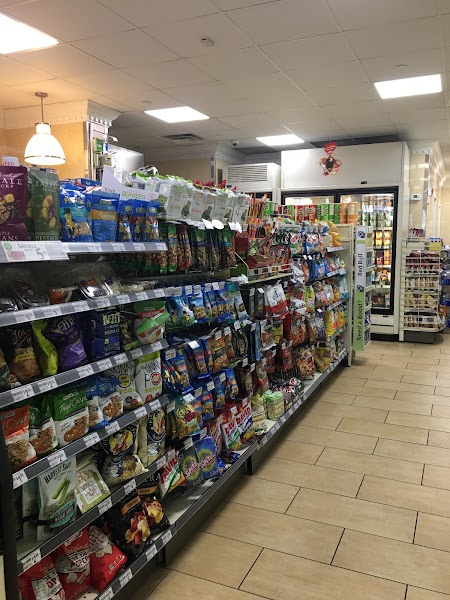
You are a GUI agent. You are given a task and a screenshot of the screen. Output one action in this format:
    pyautogui.click(x=<x>, y=<y>)
    Task: Click on the wall
    
    Given the screenshot: What is the action you would take?
    pyautogui.click(x=73, y=150), pyautogui.click(x=195, y=168), pyautogui.click(x=442, y=208)